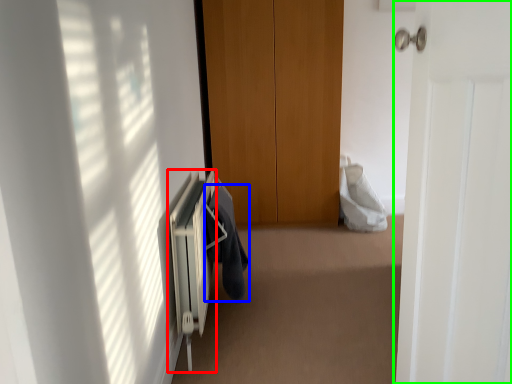
Question: Which object is the farthest from radiator (highlighted by a red box)? Choose among these: garment (highlighted by a blue box) or door (highlighted by a green box).

Choices:
 (A) garment
 (B) door

Answer: (B)